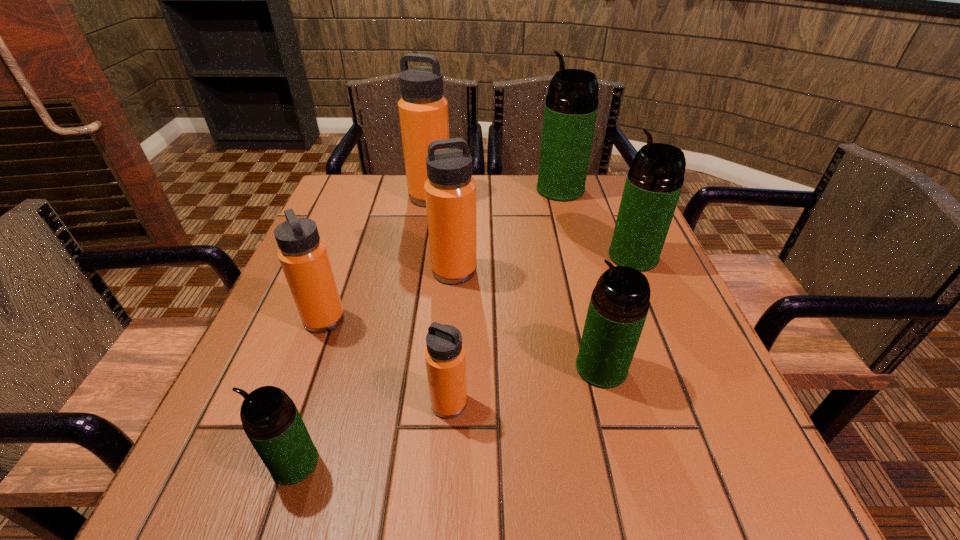
Where is `orange thermos bottle that is the third closest one to the farthest orange thermos bottle`? This screenshot has height=540, width=960. orange thermos bottle that is the third closest one to the farthest orange thermos bottle is located at coordinates (445, 357).

Identify the location of green thermos bottle object that ranks as the third closest to the third biggest green thermos bottle. (571, 106).

Select which green thermos bottle appears as the second closest to the nearest green thermos bottle. Please provide its 2D coordinates. Your answer should be formatted as a tuple, i.e. [(x, y)], where the tuple contains the x and y coordinates of a point satisfying the conditions above.

[(655, 179)]